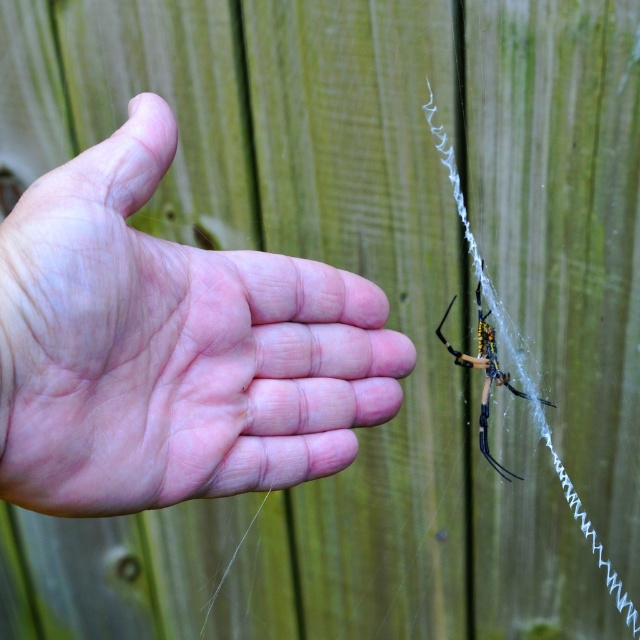
Is pink flesh at center to the left of yellow fuzzy spider at center from the viewer's perspective?

Correct, you'll find pink flesh at center to the left of yellow fuzzy spider at center.

Can you confirm if pink flesh at center is positioned above yellow fuzzy spider at center?

Yes.

Is point (145, 269) more distant than point (483, 404)?

No, it is not.

What are the coordinates of `pink flesh at center` in the screenshot? It's located at (172, 348).